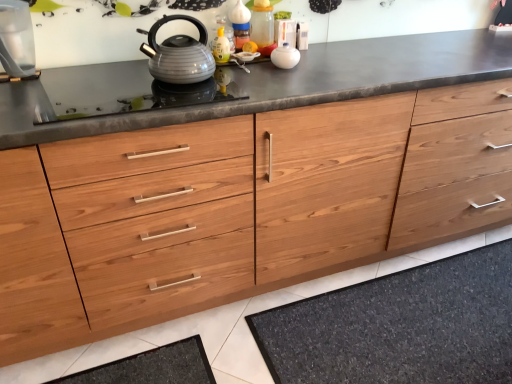
This screenshot has height=384, width=512. Find the location of `empty space that is ontop of dark gray textured bath mat at lower center (from a real-world perspective)`. empty space that is ontop of dark gray textured bath mat at lower center (from a real-world perspective) is located at coordinates (423, 327).